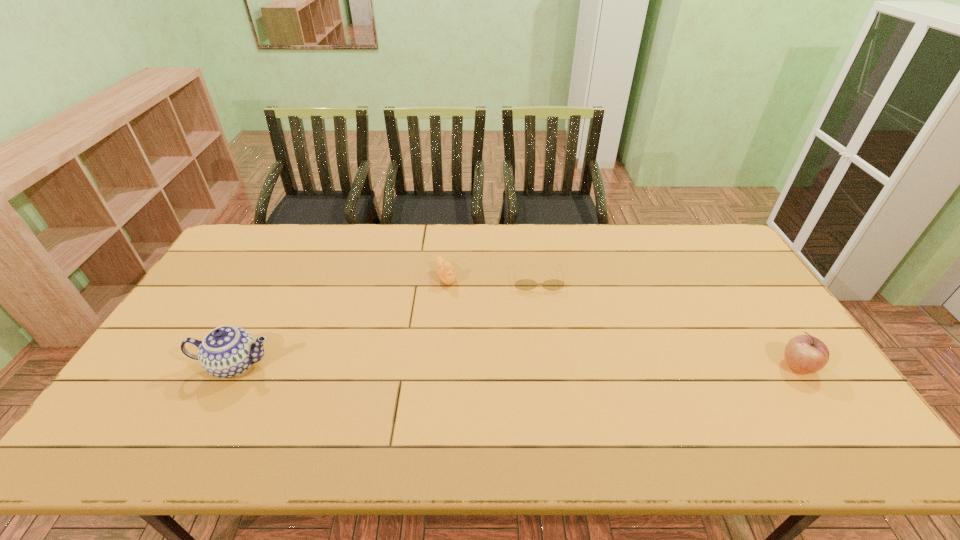
The height and width of the screenshot is (540, 960). Identify the location of vacant region located on the face of the second shortest object. (462, 308).

What are the coordinates of `blank area located 0.310m on the face of the second shortest object` in the screenshot? It's located at (492, 357).

You are a GUI agent. You are given a task and a screenshot of the screen. Output one action in this format:
    pyautogui.click(x=<x>, y=<y>)
    Task: Click on the vacant space located on the face of the shortest object
    
    Given the screenshot: What is the action you would take?
    pyautogui.click(x=542, y=313)

The width and height of the screenshot is (960, 540). Identify the location of vacant position located on the face of the shortest object. (553, 392).

At what (x,y) coordinates should I click in order to perform the action: click on vacant point located 0.060m on the face of the shortest object. Please return your answer as a coordinate pair (x, y). Looking at the image, I should click on (540, 303).

The height and width of the screenshot is (540, 960). Find the location of `object located in the left edge section of the desktop`. object located in the left edge section of the desktop is located at coordinates (227, 351).

Where is `object at the right edge`? This screenshot has width=960, height=540. object at the right edge is located at coordinates (807, 354).

Identify the location of vacant region at the far edge of the desktop. Image resolution: width=960 pixels, height=540 pixels. (676, 261).

This screenshot has width=960, height=540. Find the location of `free space at the near edge of the desktop`. free space at the near edge of the desktop is located at coordinates (300, 410).

Locate an element on the screen. The image size is (960, 540). vacant space at the right edge of the desktop is located at coordinates (712, 283).